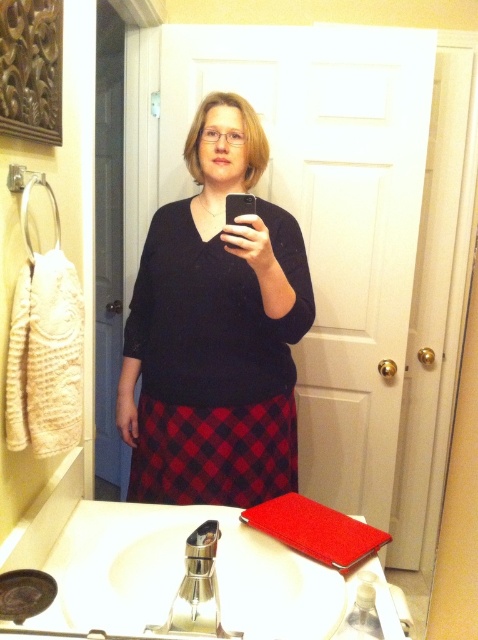
You are trying to take a selfie in the bathroom mirror. You notice the polished stainless steel faucet at sink and the black matte smartphone at center. Which object is closer to you when you look into the mirror?

The polished stainless steel faucet at sink is closer to you because it is in front of the black matte smartphone at center in the mirror.

You are a photographer trying to capture the red plaid skirt at center and the black matte smartphone at center in a single frame. Based on their sizes, which object should you focus on to ensure both fit clearly in the photo?

Since the red plaid skirt at center is larger than the black matte smartphone at center, you should focus on the red plaid skirt at center to ensure both objects fit clearly in the photo.